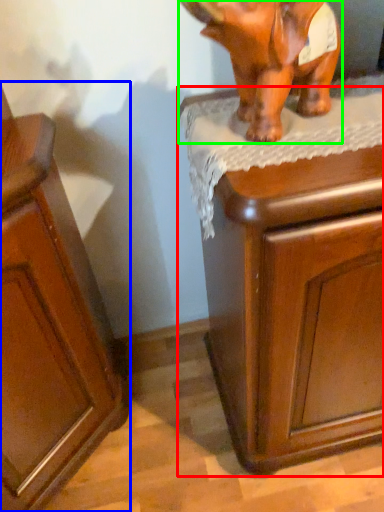
Question: Which is nearer to the chest of drawers (highlighted by a red box)? cabinetry (highlighted by a blue box) or elephant (highlighted by a green box).

Choices:
 (A) cabinetry
 (B) elephant

Answer: (B)